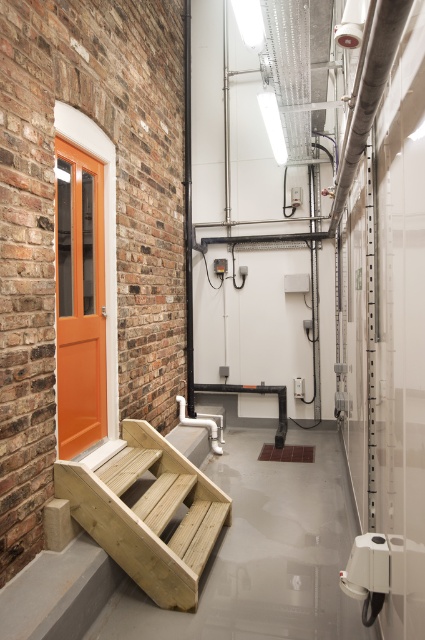
Question: Where is natural wood stairs at lower left located in relation to orange painted wood door at left in the image?

Choices:
 (A) left
 (B) right

Answer: (B)

Question: Which point is closer to the camera?

Choices:
 (A) natural wood stairs at lower left
 (B) orange painted wood door at left

Answer: (A)

Question: Is natural wood stairs at lower left further to camera compared to orange painted wood door at left?

Choices:
 (A) no
 (B) yes

Answer: (A)

Question: Does natural wood stairs at lower left lie in front of orange painted wood door at left?

Choices:
 (A) yes
 (B) no

Answer: (A)